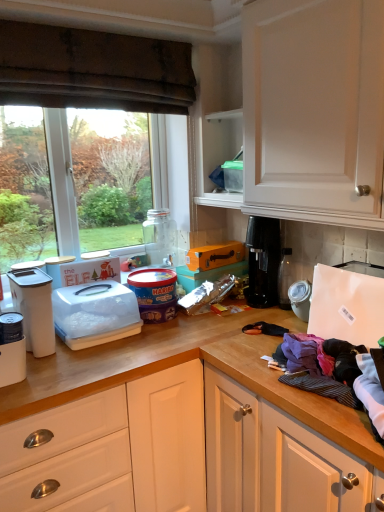
Question: Is black plastic coffee machine at right inside or outside of transparent glass jar at center?

Choices:
 (A) inside
 (B) outside

Answer: (B)

Question: Considering their positions, is black plastic coffee machine at right located in front of or behind transparent glass jar at center?

Choices:
 (A) behind
 (B) front

Answer: (B)

Question: Which object is the farthest from the transparent glass window at upper left?

Choices:
 (A) white matte refrigerator at right, the fifth appliance viewed from the left
 (B) matte plastic tub at center, marked as the second appliance in a right-to-left arrangement
 (C) purple cotton clothes at right, which appears as the second clothing when viewed from the front
 (D) white cotton shirt at lower right, which is counted as the 1th clothing, starting from the front
 (E) white plastic container at center-left, which is the third appliance in right-to-left order

Answer: (D)

Question: Which of these objects is positioned farthest from the white plastic container at center-left, which is counted as the 3th appliance, starting from the left?

Choices:
 (A) black plastic coffee machine at right
 (B) purple cotton clothes at lower right, the 3th clothing from the front
 (C) white cotton shirt at lower right, which is the third clothing from back to front
 (D) matte plastic tub at center, marked as the second appliance in a right-to-left arrangement
 (E) orange cardboard box at center

Answer: (C)